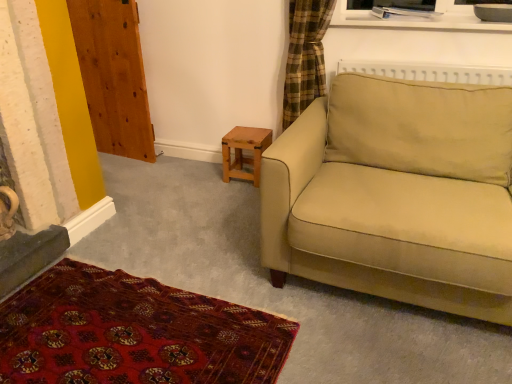
Image resolution: width=512 pixels, height=384 pixels. Find the location of `free space between wooden stool at lower center and wooden at left`. free space between wooden stool at lower center and wooden at left is located at coordinates (187, 161).